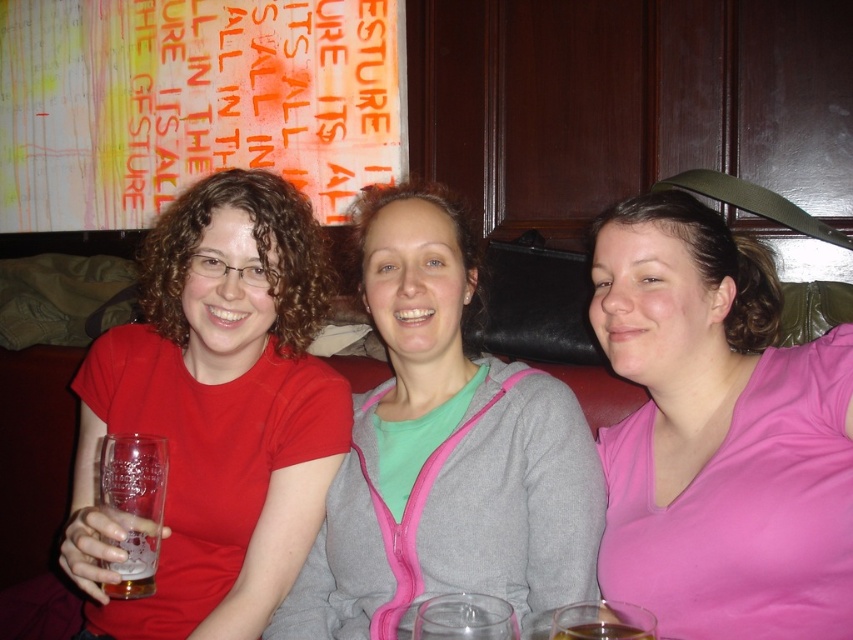
Is gray zip-up hoodie at center above translucent glass at lower right?

Yes.

Find the location of a particular element. The height and width of the screenshot is (640, 853). gray zip-up hoodie at center is located at coordinates (444, 451).

Who is more distant from viewer, (x=587, y=481) or (x=640, y=634)?

The point (x=587, y=481) is more distant.

The height and width of the screenshot is (640, 853). Identify the location of gray zip-up hoodie at center. (444, 451).

Does gray zip-up hoodie at center have a greater height compared to clear glass beer at left?

Yes.

The image size is (853, 640). Describe the element at coordinates (444, 451) in the screenshot. I see `gray zip-up hoodie at center` at that location.

Does point (439, 394) come farther from viewer compared to point (152, 563)?

Yes, it is.

Locate an element on the screen. gray zip-up hoodie at center is located at coordinates (444, 451).

In order to click on orange fabric banner at upper left in this screenshot , I will do `click(192, 102)`.

The image size is (853, 640). I want to click on orange fabric banner at upper left, so click(x=192, y=102).